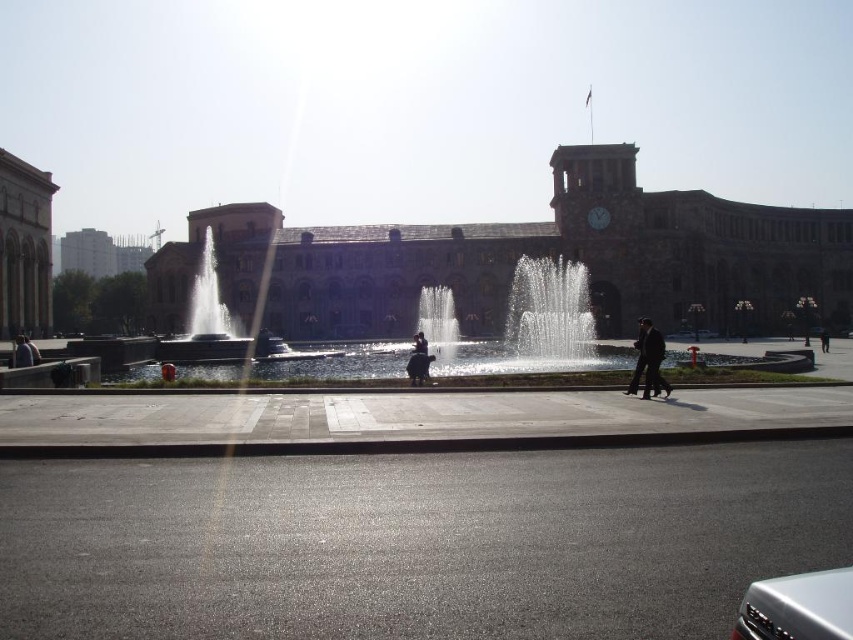
Which of these two, silver metallic car at lower right or black leather jacket at center, stands taller?

With more height is black leather jacket at center.

This screenshot has width=853, height=640. In order to click on silver metallic car at lower right in this screenshot , I will do `click(798, 608)`.

The image size is (853, 640). I want to click on silver metallic car at lower right, so click(798, 608).

Is shiny metallic fountain at center left thinner than black leather jacket at center?

Indeed, shiny metallic fountain at center left has a lesser width compared to black leather jacket at center.

The width and height of the screenshot is (853, 640). Identify the location of shiny metallic fountain at center left. (206, 321).

In the scene shown: Is shiny metallic fountain at center left below matte black jacket at lower left?

Incorrect, shiny metallic fountain at center left is not positioned below matte black jacket at lower left.

Find the location of a particular element. shiny metallic fountain at center left is located at coordinates (206, 321).

What are the coordinates of `shiny metallic fountain at center left` in the screenshot? It's located at (206, 321).